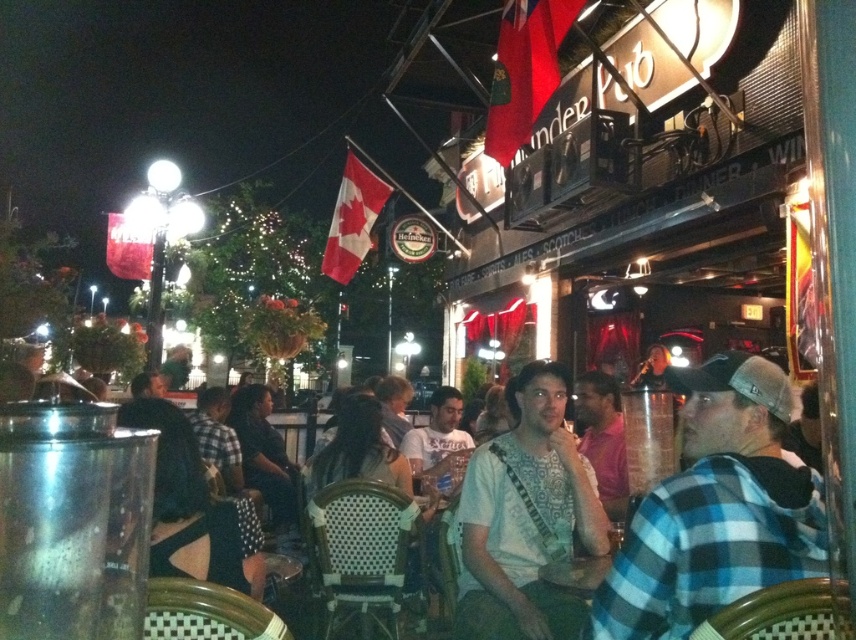
You are a photographer trying to capture a candid shot of the two people in the scene. You notice the blue plaid shirt at center and the white fabric shirt at center. Which shirt should you focus on if you want to photograph the person sitting to the left of the other?

You should focus on the white fabric shirt at center because the blue plaid shirt at center is to the right of it, meaning the person in the white fabric shirt at center is sitting to the left of the person in the blue plaid shirt at center.

You are standing at the entrance of the pub and see two shirts at the center of the scene. Which shirt is nearer to you, the blue plaid shirt at center or the white fabric shirt at center?

The blue plaid shirt at center is closer to the viewer than the white fabric shirt at center, so the blue plaid shirt at center is nearer to you.